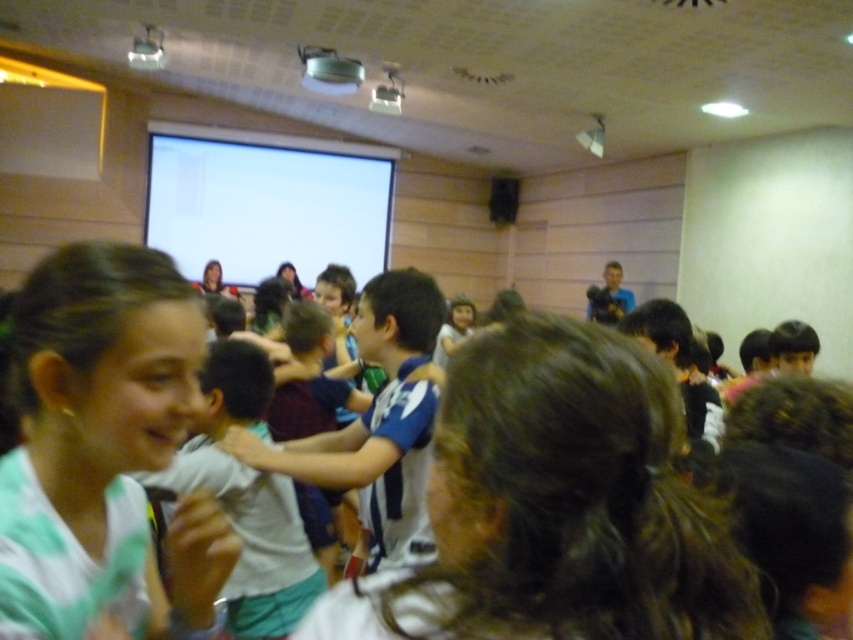
Question: Does green matte shirt at center have a smaller size compared to white glossy projection screen at upper center?

Choices:
 (A) yes
 (B) no

Answer: (A)

Question: Among these objects, which one is farthest from the camera?

Choices:
 (A) metallic projector at upper center
 (B) green matte shirt at center
 (C) white glossy projection screen at upper center

Answer: (C)

Question: Which object is positioned closest to the dark brown hair at center?

Choices:
 (A) matte black hair at center
 (B) matte black hair at upper center
 (C) white glossy projection screen at upper center
 (D) white cotton shirt at center

Answer: (D)

Question: Is dark brown hair at center smaller than matte black hair at upper center?

Choices:
 (A) no
 (B) yes

Answer: (B)

Question: Is green matte shirt at center above matte black hair at upper center?

Choices:
 (A) yes
 (B) no

Answer: (B)

Question: Which object appears closest to the camera in this image?

Choices:
 (A) white cotton shirt at center
 (B) white glossy projection screen at upper center
 (C) dark brown hair at center
 (D) matte black hair at center

Answer: (C)